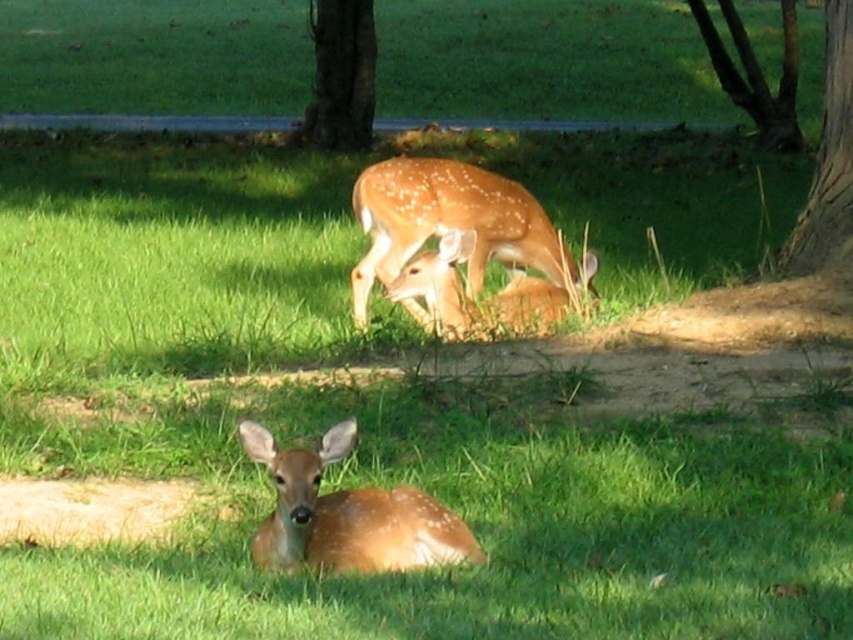
You are a photographer trying to capture a closeup of the deer in the foreground. You have two markers labeled point A at point (331,118) and point B at point (786,17). Which marker should you focus on to ensure the deer in the foreground is in focus?

Point A at point (331,118) is closer to the viewer than point B at point (786,17), so focus on point A to capture the foreground deer in focus.

You are trying to locate the point at coordinates (451, 224) in the image. Based on the scene description, where would this point be located?

The point at coordinates (451, 224) is on the spotted fur of the deer at the center of the image.